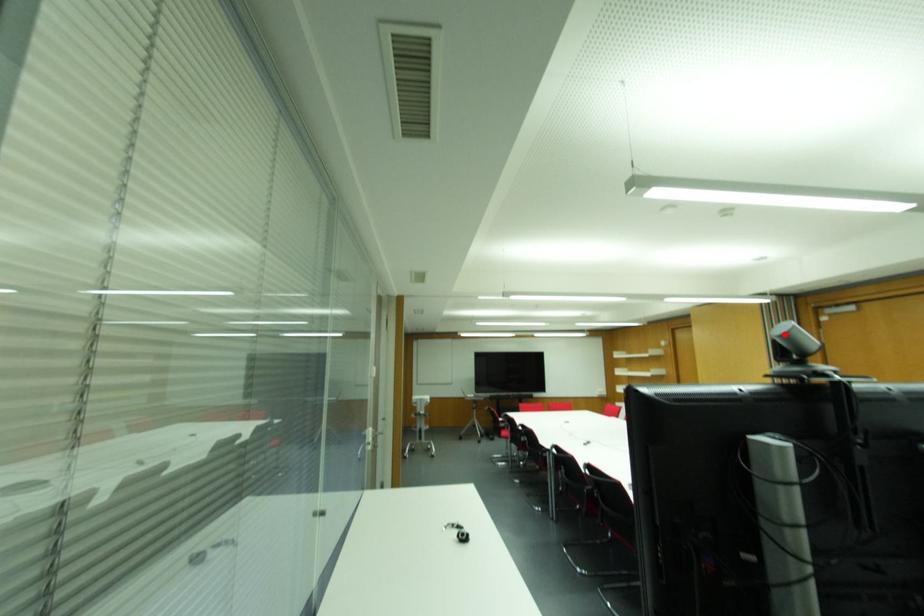
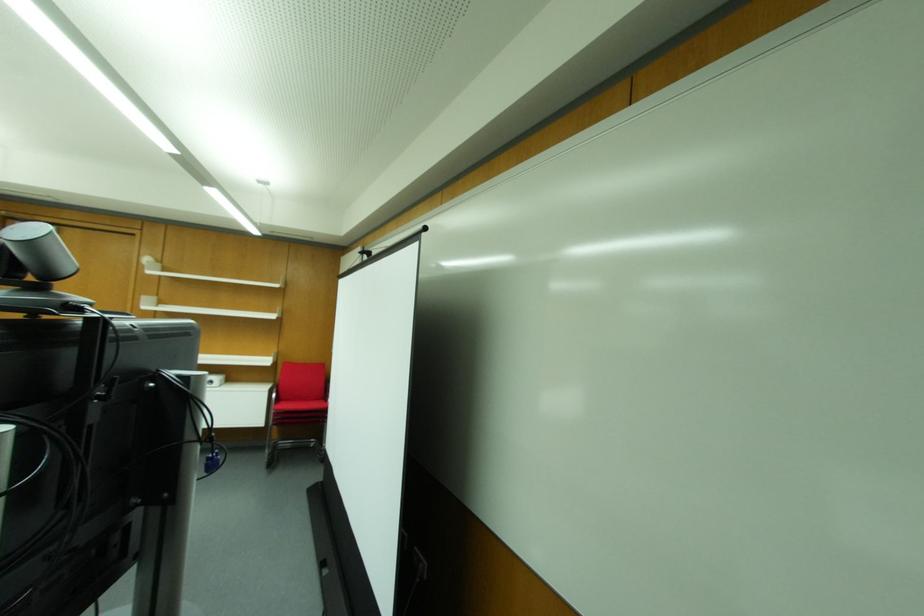
Where in the second image is the point corresponding to the highlighted location from the first image?

(30, 243)